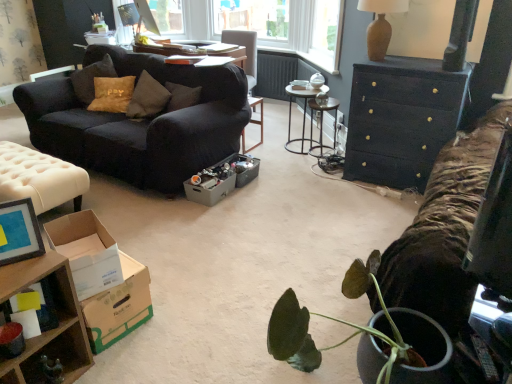
In order to face brown textured vase at upper right, should I rotate leftwards or rightwards?

A 16.330 degree turn to the right will do.

Find the location of a particular element. wooden shelf at lower left, the first table positioned from the front is located at coordinates (52, 329).

Image resolution: width=512 pixels, height=384 pixels. What do you see at coordinates (52, 329) in the screenshot?
I see `wooden shelf at lower left, which is the second table from right to left` at bounding box center [52, 329].

What is the approximate height of gray cardboard box at center, which is the first cardboard box from back to front?

It is 5.77 inches.

The image size is (512, 384). What do you see at coordinates (19, 232) in the screenshot?
I see `matte blue picture frame at lower left` at bounding box center [19, 232].

In the scene shown: Measure the distance between point (52, 235) and camera.

Point (52, 235) is 1.88 meters away from camera.

At what (x,y) coordinates should I click in order to perform the action: click on brown textured vase at upper right. Please return your answer as a coordinate pair (x, y). The height and width of the screenshot is (384, 512). Looking at the image, I should click on (380, 25).

Can you confirm if tufted leather ottoman at left, the second table viewed from the front, is thinner than matte black dresser at upper right?

No, tufted leather ottoman at left, the second table viewed from the front, is not thinner than matte black dresser at upper right.

Considering the relative positions of tufted leather ottoman at left, placed as the 3th table when sorted from right to left, and matte black dresser at upper right in the image provided, is tufted leather ottoman at left, placed as the 3th table when sorted from right to left, to the left or to the right of matte black dresser at upper right?

Clearly, tufted leather ottoman at left, placed as the 3th table when sorted from right to left, is on the left of matte black dresser at upper right in the image.

In the scene shown: Can you confirm if tufted leather ottoman at left, which is counted as the second table, starting from the bottom, is smaller than matte black dresser at upper right?

Correct, tufted leather ottoman at left, which is counted as the second table, starting from the bottom, occupies less space than matte black dresser at upper right.

Which object is wider, brown textured vase at upper right or matte black dresser at upper right?

matte black dresser at upper right is wider.

Based on the photo, is brown textured vase at upper right bigger than matte black dresser at upper right?

No.

Can we say brown textured vase at upper right lies outside matte black dresser at upper right?

Yes.

Is brown cardboard box at lower left, the 2th cardboard box in the back-to-front sequence, looking in the opposite direction of matte black couch at left?

No.

From the picture: From the image's perspective, which one is positioned lower, brown cardboard box at lower left, acting as the second cardboard box starting from the front, or matte black couch at left?

From the image's view, brown cardboard box at lower left, acting as the second cardboard box starting from the front, is below.

Based on the photo, between brown cardboard box at lower left, acting as the second cardboard box starting from the front, and matte black couch at left, which one appears on the left side from the viewer's perspective?

matte black couch at left is more to the left.

Is point (108, 306) closer to camera compared to point (147, 123)?

Yes, it is in front of point (147, 123).

Which of these two, metallic silver table at center, the third table from the bottom, or matte black couch at left, is bigger?

matte black couch at left is bigger.

Is metallic silver table at center, which is the 1th table in back-to-front order, not within matte black couch at left?

metallic silver table at center, which is the 1th table in back-to-front order, lies outside matte black couch at left's area.

Does point (324, 154) appear closer or farther from the camera than point (210, 101)?

Point (324, 154).

From a real-world perspective, which is physically above, metallic silver table at center, the 1th table in the top-to-bottom sequence, or matte black couch at left?

From a 3D spatial view, matte black couch at left is above.

Which object is closer to the camera taking this photo, metallic gray box at center or metallic silver desk at center?

metallic gray box at center is more forward.

Is metallic gray box at center thinner than metallic silver desk at center?

Correct, the width of metallic gray box at center is less than that of metallic silver desk at center.

Is metallic gray box at center touching metallic silver desk at center?

metallic gray box at center and metallic silver desk at center are not in contact.

In the scene shown: From a real-world perspective, relative to metallic silver desk at center, is metallic gray box at center vertically above or below?

Clearly, from a real-world perspective, metallic gray box at center is below metallic silver desk at center.

From a real-world perspective, who is located higher, brown textured vase at upper right or metallic silver table at center, which is the 1th table in back-to-front order?

In real-world perspective, brown textured vase at upper right is above.

Could you tell me if brown textured vase at upper right is turned towards metallic silver table at center, which ranks as the third table in front-to-back order?

No, brown textured vase at upper right is not turned towards metallic silver table at center, which ranks as the third table in front-to-back order.

Which is behind, brown textured vase at upper right or metallic silver table at center, the third table from the bottom?

metallic silver table at center, the third table from the bottom, is further away from the camera.

Is point (377, 42) positioned before point (323, 155)?

Yes, point (377, 42) is closer to viewer.

Considering the sizes of objects tufted leather ottoman at left, placed as the 2th table when sorted from back to front, and metallic silver desk at center in the image provided, who is smaller, tufted leather ottoman at left, placed as the 2th table when sorted from back to front, or metallic silver desk at center?

metallic silver desk at center.

Can you confirm if tufted leather ottoman at left, placed as the 3th table when sorted from right to left, is positioned to the right of metallic silver desk at center?

No.

From the image's perspective, is tufted leather ottoman at left, placed as the 3th table when sorted from right to left, beneath metallic silver desk at center?

Correct, tufted leather ottoman at left, placed as the 3th table when sorted from right to left, appears lower than metallic silver desk at center in the image.

Where is `cabinetry above the tufted leather ottoman at left, placed as the 2th table when sorted from back to front (from the image's perspective)`? Image resolution: width=512 pixels, height=384 pixels. cabinetry above the tufted leather ottoman at left, placed as the 2th table when sorted from back to front (from the image's perspective) is located at coordinates (401, 119).

The width and height of the screenshot is (512, 384). In order to click on table lamp on the left side of matte black dresser at upper right in this screenshot , I will do `click(380, 25)`.

Considering their positions, is matte black couch at left positioned closer to gray cardboard box at center, which is the first cardboard box from back to front, than metallic silver desk at center?

matte black couch at left lies closer to gray cardboard box at center, which is the first cardboard box from back to front, than the other object.

Estimate the real-world distances between objects in this image. Which object is further from matte blue picture frame at lower left, metallic silver table at center, the 1th table in the top-to-bottom sequence, or brown textured vase at upper right?

Among the two, metallic silver table at center, the 1th table in the top-to-bottom sequence, is located further to matte blue picture frame at lower left.

Which object lies further to the anchor point brown cardboard box at lower left, acting as the second cardboard box starting from the front, gray cardboard box at center, positioned as the third cardboard box in front-to-back order, or metallic silver desk at center?

metallic silver desk at center lies further to brown cardboard box at lower left, acting as the second cardboard box starting from the front, than the other object.

Considering their positions, is matte black dresser at upper right positioned closer to metallic gray box at center than wooden shelf at lower left, the 3th table positioned from the top?

matte black dresser at upper right.

Based on their spatial positions, is matte black dresser at upper right or metallic gray box at center further from gray cardboard box at center, positioned as the third cardboard box in front-to-back order?

matte black dresser at upper right.

When comparing their distances from metallic gray box at center, does metallic silver table at center, which ranks as the first table in right-to-left order, or brown textured vase at upper right seem further?

The object further to metallic gray box at center is brown textured vase at upper right.

Looking at the image, which one is located further to brown textured vase at upper right, tufted leather ottoman at left, acting as the 1th table starting from the left, or metallic silver desk at center?

Among the two, tufted leather ottoman at left, acting as the 1th table starting from the left, is located further to brown textured vase at upper right.

From the image, which object appears to be nearer to wooden shelf at lower left, the first table positioned from the front, metallic silver desk at center or white cardboard box at lower left, the 3th cardboard box from the back?

Among the two, white cardboard box at lower left, the 3th cardboard box from the back, is located nearer to wooden shelf at lower left, the first table positioned from the front.

The image size is (512, 384). In order to click on desk located between gray cardboard box at center, positioned as the third cardboard box in front-to-back order, and brown textured vase at upper right in the left-right direction in this screenshot , I will do `click(303, 109)`.

The image size is (512, 384). In order to click on box between wooden shelf at lower left, which appears as the third table when viewed from the back, and metallic silver table at center, which ranks as the first table in right-to-left order, from front to back in this screenshot , I will do `click(245, 169)`.

What are the coordinates of `table located between brown cardboard box at lower left, acting as the second cardboard box starting from the front, and matte black dresser at upper right in the left-right direction` in the screenshot? It's located at (322, 126).

This screenshot has height=384, width=512. Identify the location of cardboard box between brown cardboard box at lower left, the 2th cardboard box in the back-to-front sequence, and metallic silver desk at center, along the z-axis. (209, 190).